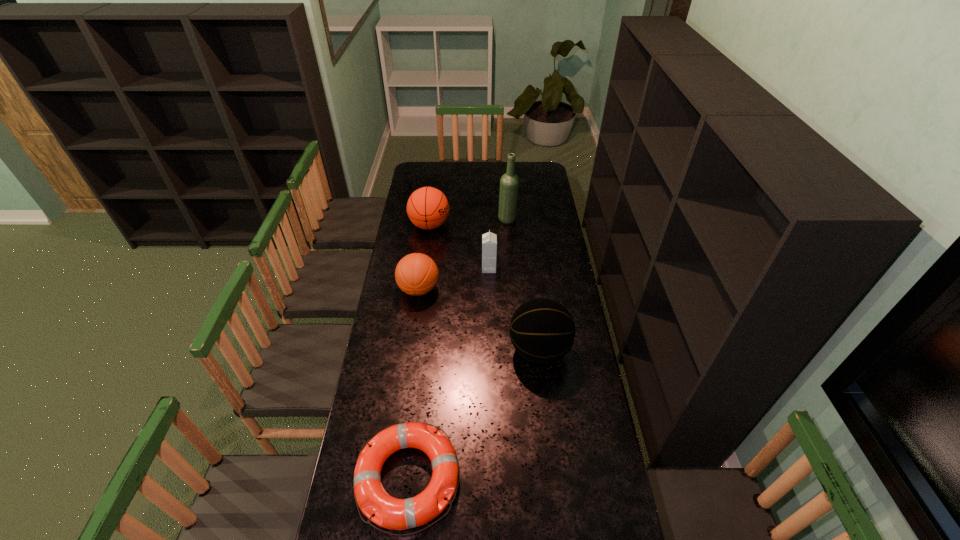
Find the location of `free location that satisfies the following two spatial constraints: 1. on the front side of the wine bottle; 2. on the right side of the second nearest object`. free location that satisfies the following two spatial constraints: 1. on the front side of the wine bottle; 2. on the right side of the second nearest object is located at coordinates (517, 350).

Identify the location of free space that satisfies the following two spatial constraints: 1. on the side with logo of the farthest basketball; 2. on the back side of the life buoy. (396, 478).

Where is `vacant space that satisfies the following two spatial constraints: 1. on the back side of the shortest object; 2. on the right side of the wine bottle`? The width and height of the screenshot is (960, 540). vacant space that satisfies the following two spatial constraints: 1. on the back side of the shortest object; 2. on the right side of the wine bottle is located at coordinates (438, 220).

Locate an element on the screen. free space that satisfies the following two spatial constraints: 1. on the back side of the shortest object; 2. on the side with logo of the farthest basketball is located at coordinates (437, 225).